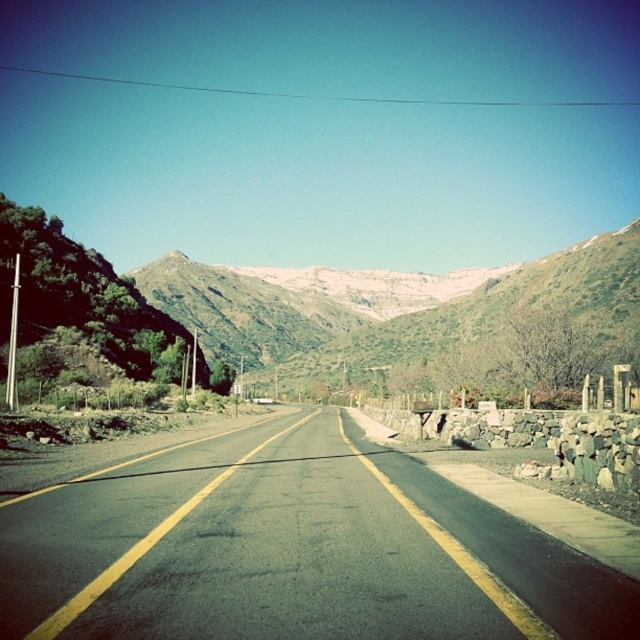
Is point (172, 259) in front of point (372, 428)?

No.

Is point (484, 269) more distant than point (632, 525)?

Yes, point (484, 269) is farther from viewer.

At what (x,y) coordinates should I click in order to perform the action: click on green grassy mountain at center. Please return your answer as a coordinate pair (x, y). This screenshot has height=640, width=640. Looking at the image, I should click on (378, 305).

Is asphalt road at center closer to camera compared to green grassy mountain at center?

Yes, asphalt road at center is closer to the viewer.

Between point (282, 532) and point (202, 282), which one is positioned behind?

The point (202, 282) is behind.

Locate an element on the screen. The image size is (640, 640). asphalt road at center is located at coordinates (294, 548).

How distant is asphalt road at center from smooth stone wall at right?

asphalt road at center and smooth stone wall at right are 14.47 feet apart.

Which is above, asphalt road at center or smooth stone wall at right?

asphalt road at center is above.

Is point (305, 522) closer to viewer compared to point (497, 508)?

Yes, point (305, 522) is closer to viewer.

Find the location of `asphalt road at center`. asphalt road at center is located at coordinates (294, 548).